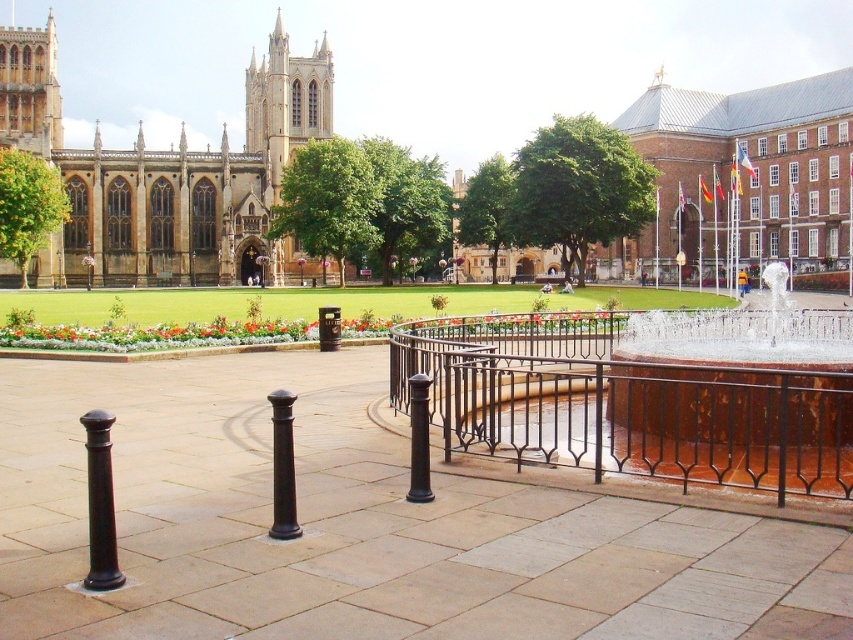
Question: Where is polished dark brown bollard at lower left located in relation to black polished post at center in the image?

Choices:
 (A) below
 (B) above

Answer: (A)

Question: Can you confirm if black wrought iron fence at center is smaller than polished dark brown bollard at lower left?

Choices:
 (A) yes
 (B) no

Answer: (B)

Question: Which point appears closest to the camera in this image?

Choices:
 (A) (276, 467)
 (B) (109, 452)

Answer: (B)

Question: Which point appears farthest from the camera in this image?

Choices:
 (A) (270, 401)
 (B) (100, 484)

Answer: (A)

Question: Which point is farther from the camera taking this photo?

Choices:
 (A) (108, 570)
 (B) (610, 384)
 (C) (277, 456)

Answer: (B)

Question: Can you confirm if polished dark brown bollard at lower left is positioned to the left of black polished post at center?

Choices:
 (A) no
 (B) yes

Answer: (B)